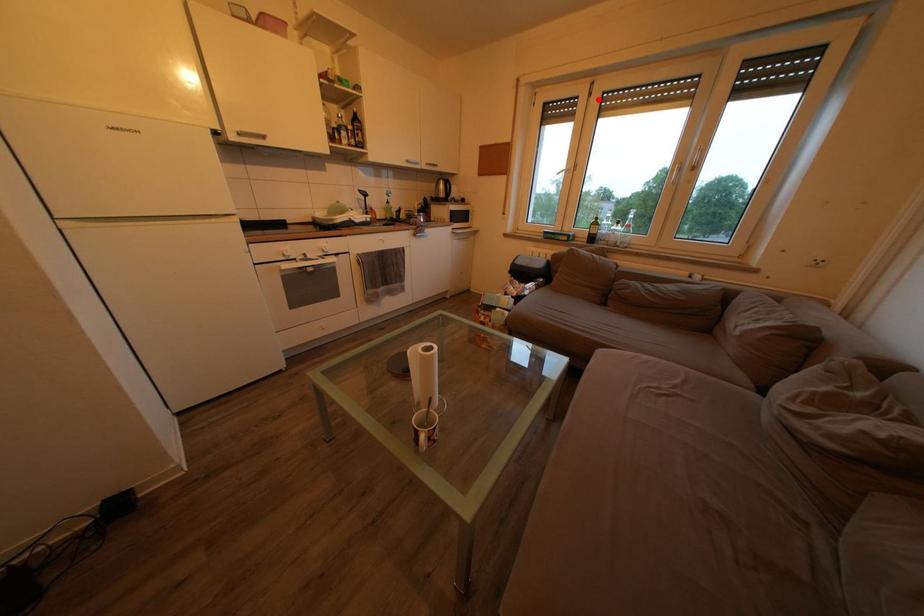
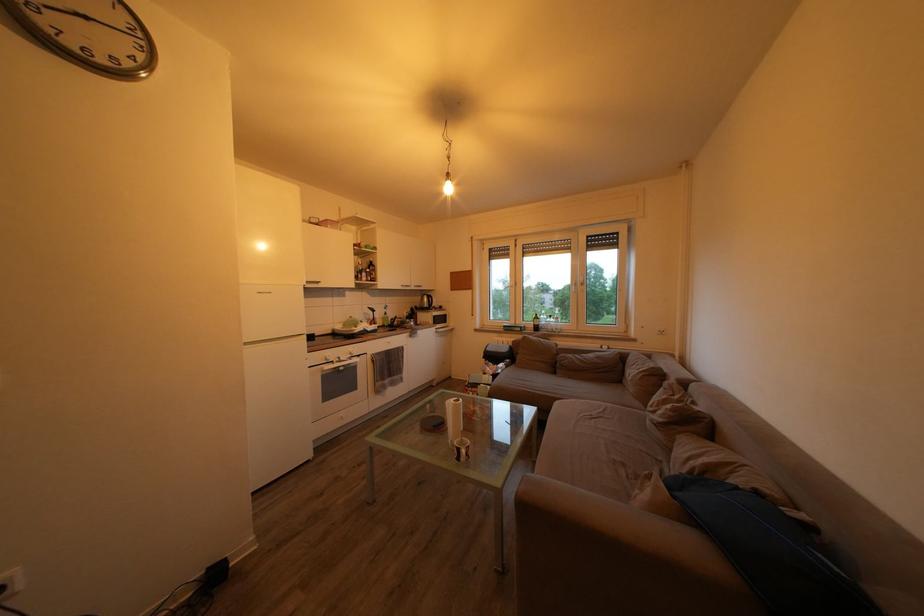
Question: A red point is marked in image1. In image2, is the corresponding 3D point closer to the camera or farther? Reply with the corresponding letter.

Choices:
 (A) The corresponding 3D point is closer.
 (B) The corresponding 3D point is farther.

Answer: (A)